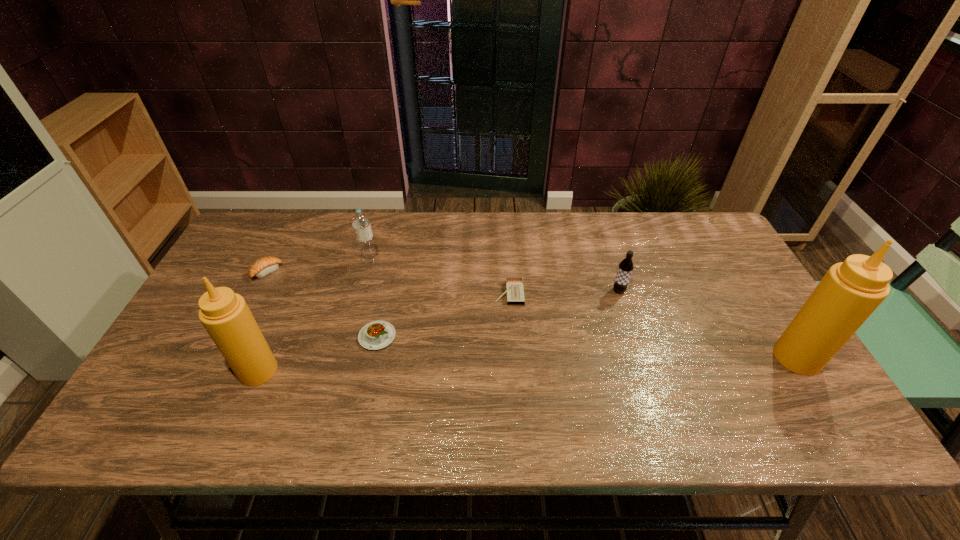
What are the coordinates of `object that is at the far edge` in the screenshot? It's located at (360, 222).

Locate an element on the screen. object present at the left edge is located at coordinates (263, 266).

Where is `object at the right edge`? This screenshot has height=540, width=960. object at the right edge is located at coordinates (850, 291).

Locate an element on the screen. The image size is (960, 540). object that is at the near right corner is located at coordinates (850, 291).

In the image, there is a desktop. Where is `vacant space at the far edge`? Image resolution: width=960 pixels, height=540 pixels. vacant space at the far edge is located at coordinates (516, 225).

In the image, there is a desktop. Where is `blank space at the left edge`? This screenshot has height=540, width=960. blank space at the left edge is located at coordinates (247, 288).

This screenshot has width=960, height=540. In order to click on vacant space at the far left corner of the desktop in this screenshot , I will do `click(257, 216)`.

Locate an element on the screen. This screenshot has width=960, height=540. vacant space at the near left corner of the desktop is located at coordinates (172, 377).

Where is `vacant point located between the shortest object and the second object from right to left`? This screenshot has width=960, height=540. vacant point located between the shortest object and the second object from right to left is located at coordinates (564, 292).

Find the location of a particular element. The height and width of the screenshot is (540, 960). free space between the second object from right to left and the sixth object from right to left is located at coordinates (439, 330).